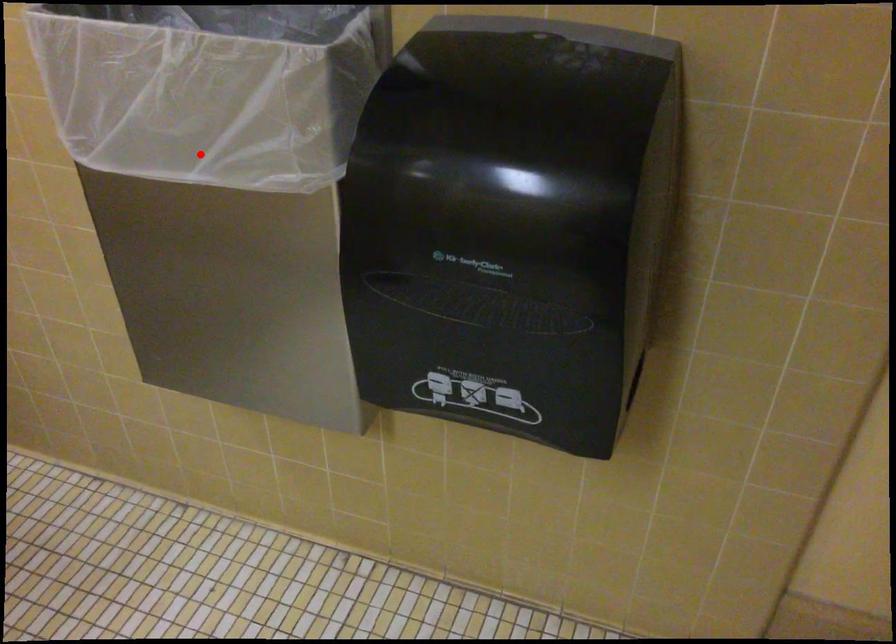
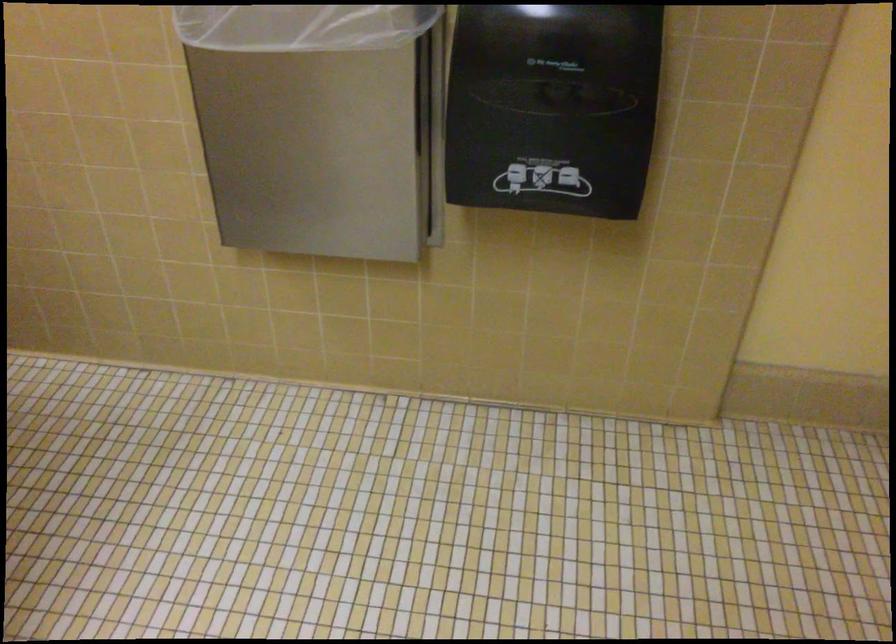
Where in the second image is the point corresponding to the highlighted location from the first image?

(300, 26)